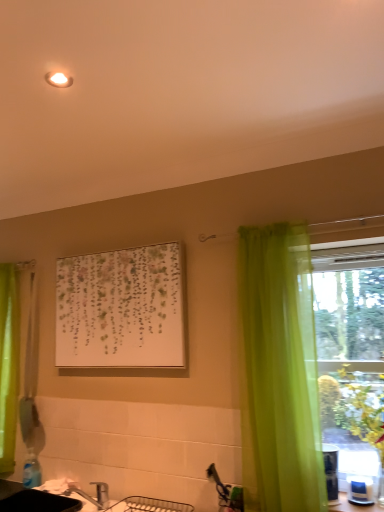
Question: Should I look upward or downward to see green sheer curtain at left, placed as the second curtain when sorted from front to back?

Choices:
 (A) down
 (B) up

Answer: (A)

Question: From the image's perspective, is green sheer curtain at left, the 1th curtain positioned from the left, below white glossy counter top at lower right?

Choices:
 (A) yes
 (B) no

Answer: (B)

Question: Is green sheer curtain at left, the 1th curtain positioned from the left, oriented towards white glossy counter top at lower right?

Choices:
 (A) yes
 (B) no

Answer: (B)

Question: Does green sheer curtain at left, which is counted as the 1th curtain, starting from the back, have a larger size compared to white glossy counter top at lower right?

Choices:
 (A) no
 (B) yes

Answer: (B)

Question: Considering the relative positions of green sheer curtain at left, the 1th curtain positioned from the left, and white glossy counter top at lower right in the image provided, is green sheer curtain at left, the 1th curtain positioned from the left, to the right of white glossy counter top at lower right from the viewer's perspective?

Choices:
 (A) yes
 (B) no

Answer: (B)

Question: Is green sheer curtain at left, placed as the second curtain when sorted from front to back, next to white glossy counter top at lower right and touching it?

Choices:
 (A) no
 (B) yes

Answer: (A)

Question: Is green sheer curtain at left, marked as the second curtain in a right-to-left arrangement, in front of white glossy counter top at lower right?

Choices:
 (A) no
 (B) yes

Answer: (A)

Question: Is green leafy plant at right positioned before green sheer curtain at left, marked as the second curtain in a right-to-left arrangement?

Choices:
 (A) no
 (B) yes

Answer: (B)

Question: Does green leafy plant at right turn towards green sheer curtain at left, marked as the second curtain in a right-to-left arrangement?

Choices:
 (A) yes
 (B) no

Answer: (B)

Question: From a real-world perspective, is green leafy plant at right beneath green sheer curtain at left, marked as the second curtain in a right-to-left arrangement?

Choices:
 (A) yes
 (B) no

Answer: (A)

Question: Considering the relative sizes of green leafy plant at right and green sheer curtain at left, marked as the second curtain in a right-to-left arrangement, in the image provided, is green leafy plant at right smaller than green sheer curtain at left, marked as the second curtain in a right-to-left arrangement,?

Choices:
 (A) yes
 (B) no

Answer: (A)

Question: Does green leafy plant at right have a greater width compared to green sheer curtain at left, the 1th curtain positioned from the left?

Choices:
 (A) no
 (B) yes

Answer: (B)

Question: Is green leafy plant at right taller than green sheer curtain at left, the 1th curtain positioned from the left?

Choices:
 (A) no
 (B) yes

Answer: (A)

Question: Does white glossy counter top at lower right have a larger size compared to green leafy plant at right?

Choices:
 (A) yes
 (B) no

Answer: (B)